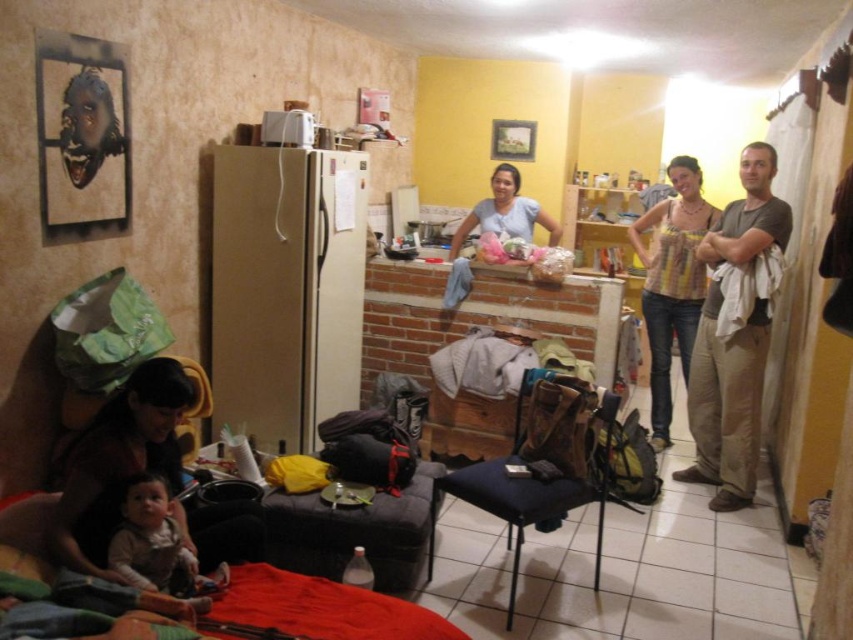
In the scene shown: Is dark gray fabric stool at center thinner than light brown fabric baby at lower left?

In fact, dark gray fabric stool at center might be wider than light brown fabric baby at lower left.

Does dark gray fabric stool at center lie in front of light brown fabric baby at lower left?

No, dark gray fabric stool at center is behind light brown fabric baby at lower left.

Locate an element on the screen. The height and width of the screenshot is (640, 853). dark gray fabric stool at center is located at coordinates [x=354, y=532].

At what (x,y) coordinates should I click in order to perform the action: click on dark gray fabric stool at center. Please return your answer as a coordinate pair (x, y). Looking at the image, I should click on (354, 532).

Does brown cotton shirt at right have a lesser height compared to light brown fabric baby at lower left?

No, brown cotton shirt at right is not shorter than light brown fabric baby at lower left.

Between point (747, 448) and point (165, 545), which one is positioned behind?

The point (747, 448) is more distant.

This screenshot has height=640, width=853. In order to click on brown cotton shirt at right in this screenshot , I will do `click(726, 404)`.

Is brown cotton shirt at right positioned in front of dark gray fabric stool at center?

No, it is behind dark gray fabric stool at center.

What do you see at coordinates (726, 404) in the screenshot?
I see `brown cotton shirt at right` at bounding box center [726, 404].

Locate an element on the screen. brown cotton shirt at right is located at coordinates (726, 404).